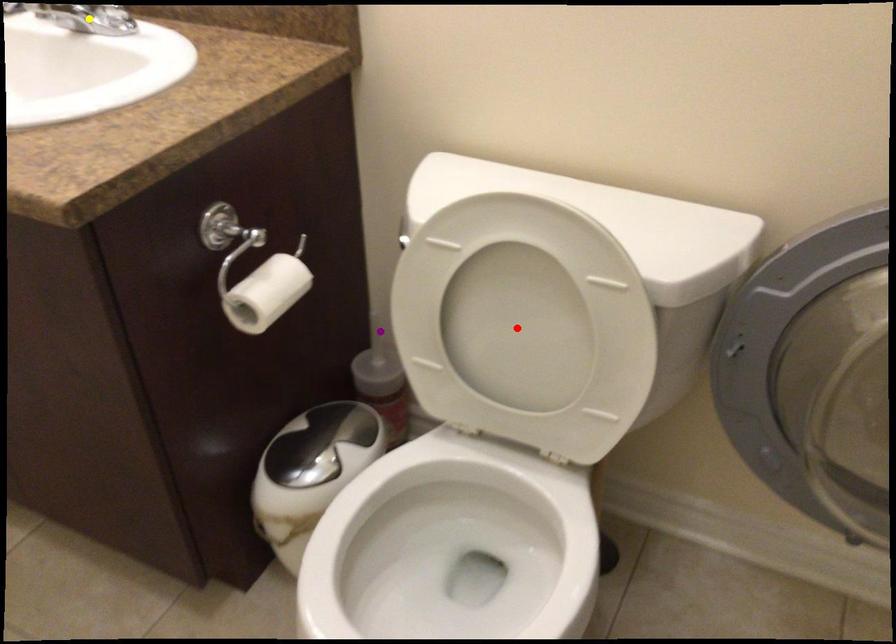
Based on the photo, order these from nearest to farthest:
A) red point
B) yellow point
C) purple point

red point < yellow point < purple point